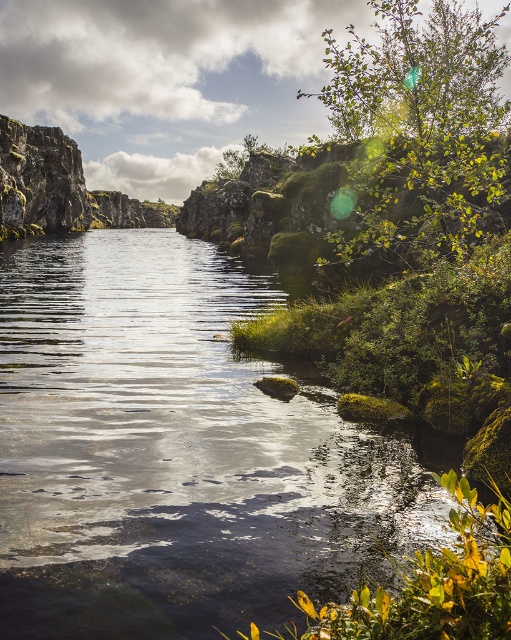
Question: Is clear water at center thinner than green leafy tree at upper right?

Choices:
 (A) yes
 (B) no

Answer: (A)

Question: Is clear water at center above green leafy plant at lower right?

Choices:
 (A) no
 (B) yes

Answer: (B)

Question: Is clear water at center above green leafy tree at upper right?

Choices:
 (A) no
 (B) yes

Answer: (A)

Question: Based on their relative distances, which object is farther from the green leafy plant at lower right?

Choices:
 (A) green leafy tree at upper right
 (B) clear water at center

Answer: (A)

Question: Which of the following is the closest to the observer?

Choices:
 (A) clear water at center
 (B) green leafy plant at lower right

Answer: (B)

Question: Among these objects, which one is farthest from the camera?

Choices:
 (A) green leafy plant at lower right
 (B) clear water at center

Answer: (B)